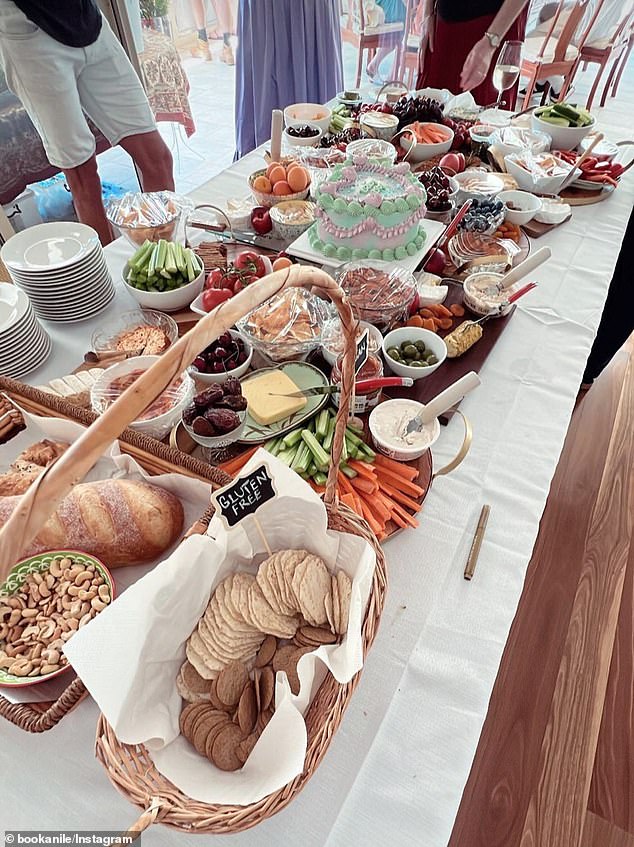
You are a GUI agent. You are given a task and a screenshot of the screen. Output one action in this format:
    pyautogui.click(x=<x>, y=<y>)
    Task: Click on the plates
    Image resolution: width=634 pixels, height=847 pixels.
    Given the screenshot: What is the action you would take?
    pyautogui.click(x=28, y=313), pyautogui.click(x=70, y=240)